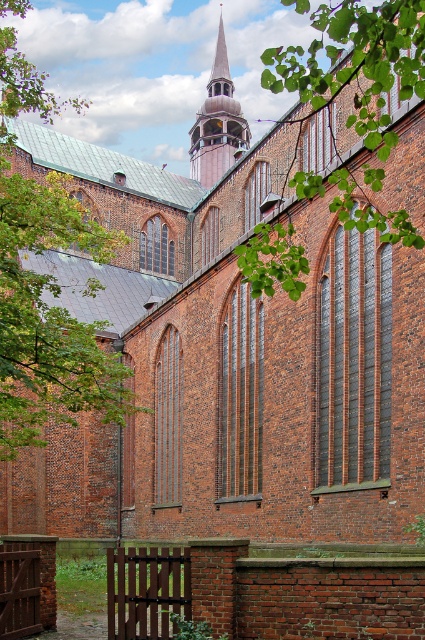
You are standing in front of the church gate and looking towards the building. Which object, the green leafy tree at left or the green leafy branch at upper center, is closer to you?

The green leafy tree at left is closer to you because the green leafy branch at upper center is behind it.

You are standing in front of the church and see a point marked at coordinates (x=45, y=284). Based on the scene description, can you identify what this point is located on?

The point at coordinates (x=45, y=284) is located on the green leafy tree at left.

You are a painter standing in front of the historic brick church. You notice two elements in the scene that you want to include in your painting. Which of the two objects, the green leafy branch at upper center or the wooden spire at center, should you paint larger to accurately represent their sizes as seen from your current viewpoint?

The green leafy branch at upper center should be painted larger than the wooden spire at center because it has a larger size compared to the wooden spire at center according to the description.